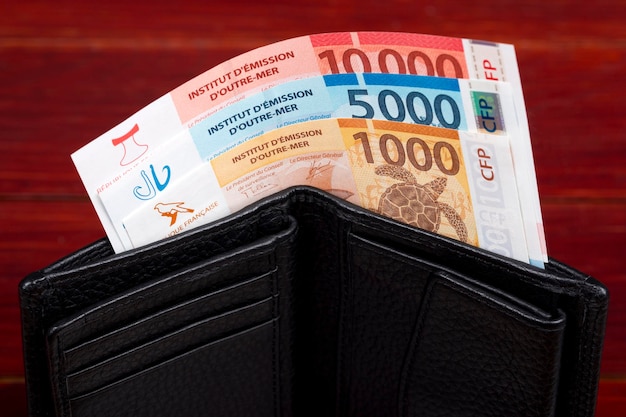
Identify the location of card holders. (230, 275), (218, 308), (217, 330).